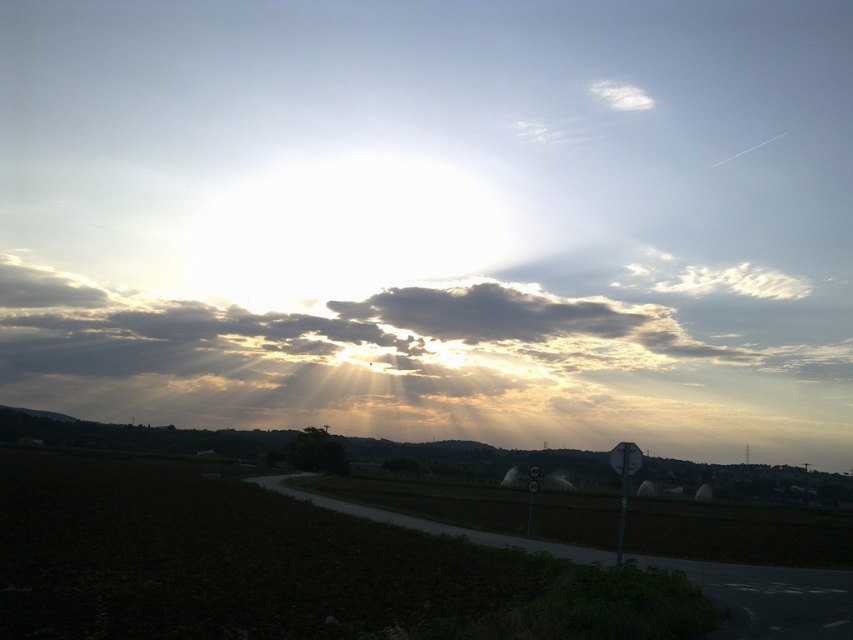
You are driving on the road and see the cloudy at upper center and the metallic reflective speed limit sign at lower right. Which object appears bigger in the scene?

The cloudy at upper center appears bigger than the metallic reflective speed limit sign at lower right because it has a larger size compared to it.

You are driving along the road and see the cloudy at upper center and the white plastic sign at right. Which object is bigger in the scene?

The cloudy at upper center is larger in size than the white plastic sign at right.